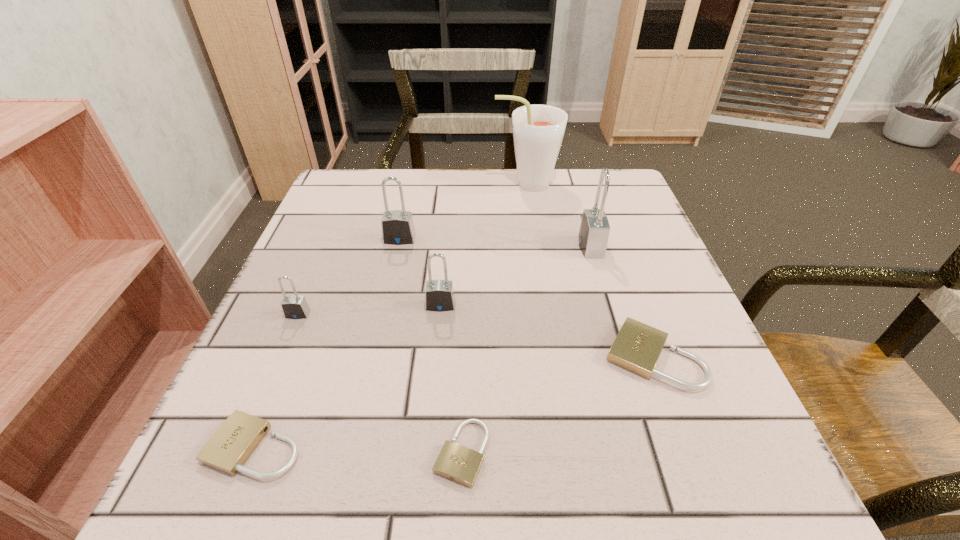
The width and height of the screenshot is (960, 540). I want to click on the tallest object, so pyautogui.click(x=538, y=130).

Find the location of a particular element. This screenshot has width=960, height=540. the third object from right to left is located at coordinates (538, 130).

You are a GUI agent. You are given a task and a screenshot of the screen. Output one action in this format:
    pyautogui.click(x=<x>, y=<y>)
    Task: Click on the tallest padlock
    
    Given the screenshot: What is the action you would take?
    pyautogui.click(x=594, y=230)

At what (x,y) coordinates should I click in order to perform the action: click on the biggest gray padlock. Please return your answer as a coordinate pair (x, y). Looking at the image, I should click on (594, 230).

Image resolution: width=960 pixels, height=540 pixels. What are the coordinates of `the third smallest gray padlock` in the screenshot? It's located at (397, 226).

Image resolution: width=960 pixels, height=540 pixels. In order to click on the third object from left to right in this screenshot , I will do `click(397, 226)`.

The width and height of the screenshot is (960, 540). Find the location of `the fifth shortest object`. the fifth shortest object is located at coordinates (439, 294).

Identify the location of the third gray padlock from left to right. The height and width of the screenshot is (540, 960). (439, 294).

Identify the location of the fourth shortest object. (295, 306).

Find the location of a particular element. the fourth tallest padlock is located at coordinates (295, 306).